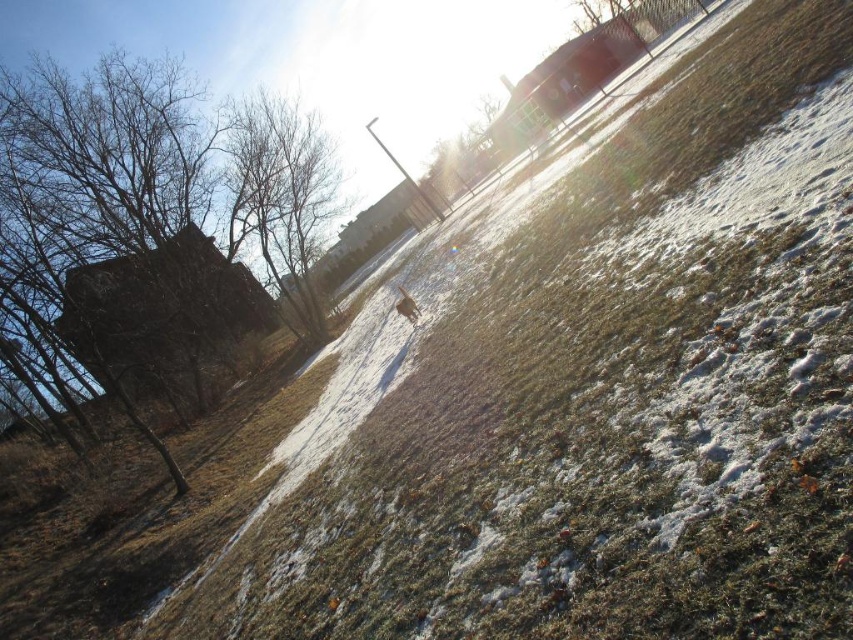
Question: Which point is farther to the camera?

Choices:
 (A) (413, 307)
 (B) (242, 186)

Answer: (B)

Question: Is brown leafless tree at left positioned before brown fur at center?

Choices:
 (A) no
 (B) yes

Answer: (B)

Question: Which object is the farthest from the brown leafless tree at upper left?

Choices:
 (A) brown fur at center
 (B) brown leafless tree at left

Answer: (A)

Question: Can you confirm if brown leafless tree at upper left is positioned below brown fur at center?

Choices:
 (A) yes
 (B) no

Answer: (B)

Question: Which point is closer to the camera?

Choices:
 (A) (276, 232)
 (B) (308, 340)

Answer: (B)

Question: Is brown leafless tree at left thinner than brown leafless tree at upper left?

Choices:
 (A) no
 (B) yes

Answer: (A)